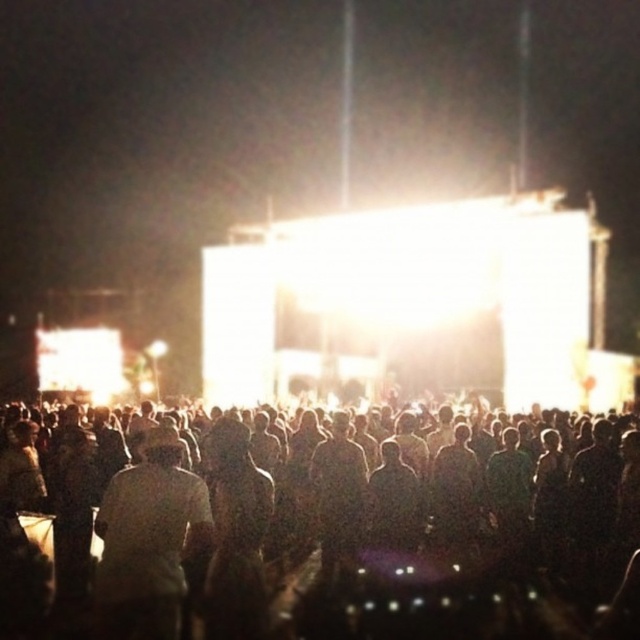
You are a photographer at the concert. You want to capture a photo where both the dark silhouettes at center and the white matte shirt at center are visible. Which object should be placed closer to the edge of the frame to avoid overcrowding?

The white matte shirt at center should be placed closer to the edge of the frame because its width is narrower than the dark silhouettes at center, making it easier to fit without overcrowding.

You are a photographer standing at the camera position. You want to capture a photo of the dark silhouettes at center against the bright stage backdrop. Considering the distance between you and the silhouettes, will you need a flash to properly illuminate the subjects?

The dark silhouettes at center are 37.49 meters away from the camera. Since the distance is quite large, a flash might not effectively illuminate subjects that far away. It would be better to rely on the existing stage lighting to create the silhouette effect.

You are a photographer at the concert and want to capture the dark silhouettes at center in your photo. What are the coordinates where you should focus your camera?

The dark silhouettes at center are located at coordinates (360, 538), so you should focus your camera there to capture them.